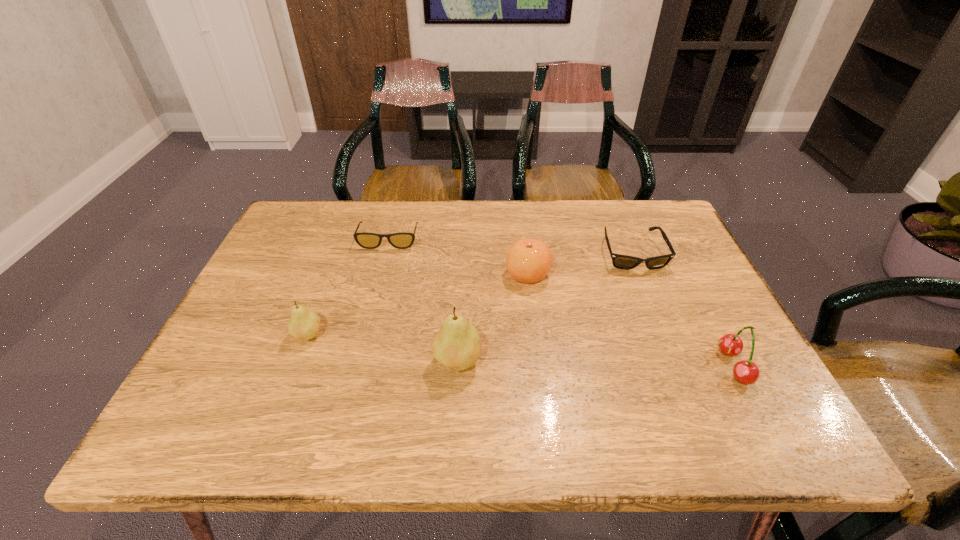
Where is `the shorter pear`? This screenshot has height=540, width=960. the shorter pear is located at coordinates (304, 324).

Find the location of a particular element. This screenshot has height=540, width=960. the left pear is located at coordinates (304, 324).

Where is `the taller pear`? Image resolution: width=960 pixels, height=540 pixels. the taller pear is located at coordinates (457, 346).

Where is `the right pear`? This screenshot has width=960, height=540. the right pear is located at coordinates (457, 346).

Locate an element on the screen. the fifth object from left to right is located at coordinates (625, 262).

Locate an element on the screen. the left sunglasses is located at coordinates (402, 240).

I want to click on clementine, so click(x=528, y=260).

Where is `the third object from right to left`? Image resolution: width=960 pixels, height=540 pixels. the third object from right to left is located at coordinates (528, 260).

This screenshot has height=540, width=960. I want to click on the rightmost object, so click(746, 372).

Find the location of a particular element. This screenshot has height=540, width=960. vacant space located on the back of the leftmost object is located at coordinates (342, 245).